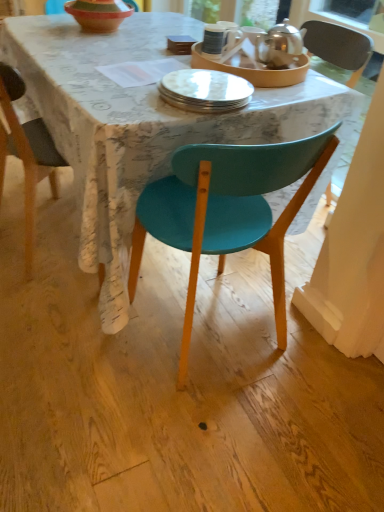
Question: Considering the relative sizes of matte teal chair at center and polished silver teapot at upper right, the 2th tableware in the left-to-right sequence, in the image provided, is matte teal chair at center smaller than polished silver teapot at upper right, the 2th tableware in the left-to-right sequence,?

Choices:
 (A) no
 (B) yes

Answer: (A)

Question: Considering the relative positions of matte teal chair at center and polished silver teapot at upper right, the 2th tableware in the left-to-right sequence, in the image provided, is matte teal chair at center behind polished silver teapot at upper right, the 2th tableware in the left-to-right sequence,?

Choices:
 (A) no
 (B) yes

Answer: (A)

Question: Is matte teal chair at center positioned in front of polished silver teapot at upper right, the 2th tableware in the left-to-right sequence?

Choices:
 (A) yes
 (B) no

Answer: (A)

Question: Considering the relative sizes of matte teal chair at center and polished silver teapot at upper right, the 2th tableware in the left-to-right sequence, in the image provided, is matte teal chair at center taller than polished silver teapot at upper right, the 2th tableware in the left-to-right sequence,?

Choices:
 (A) yes
 (B) no

Answer: (A)

Question: Does matte teal chair at center have a lesser height compared to polished silver teapot at upper right, which is counted as the first tableware, starting from the right?

Choices:
 (A) no
 (B) yes

Answer: (A)

Question: From a real-world perspective, is matte teal chair at center physically below polished silver teapot at upper right, the 2th tableware in the left-to-right sequence?

Choices:
 (A) no
 (B) yes

Answer: (B)

Question: Would you say matte teal chair at center is part of white glossy mug at upper center's contents?

Choices:
 (A) yes
 (B) no

Answer: (B)

Question: Is white glossy mug at upper center closer to the viewer compared to matte teal chair at center?

Choices:
 (A) yes
 (B) no

Answer: (B)

Question: Are white glossy mug at upper center and matte teal chair at center beside each other?

Choices:
 (A) yes
 (B) no

Answer: (B)

Question: Is white glossy mug at upper center behind matte teal chair at center?

Choices:
 (A) yes
 (B) no

Answer: (A)

Question: Is there a large distance between white glossy mug at upper center and matte teal chair at center?

Choices:
 (A) no
 (B) yes

Answer: (A)

Question: Is white glossy mug at upper center facing towards matte teal chair at center?

Choices:
 (A) no
 (B) yes

Answer: (A)

Question: Can you confirm if matte teal chair at center is positioned to the left of matte white plate at center, which ranks as the second tableware in right-to-left order?

Choices:
 (A) yes
 (B) no

Answer: (A)